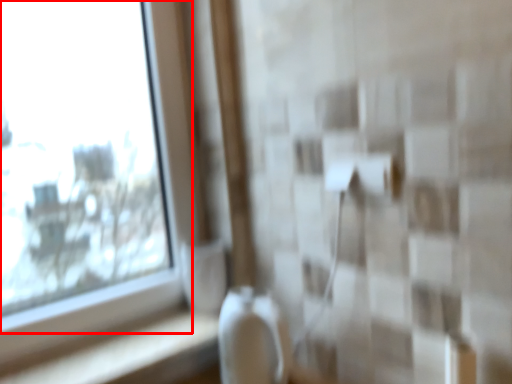
Question: From the image's perspective, where is window (annotated by the red box) located relative to ledge?

Choices:
 (A) below
 (B) above

Answer: (B)